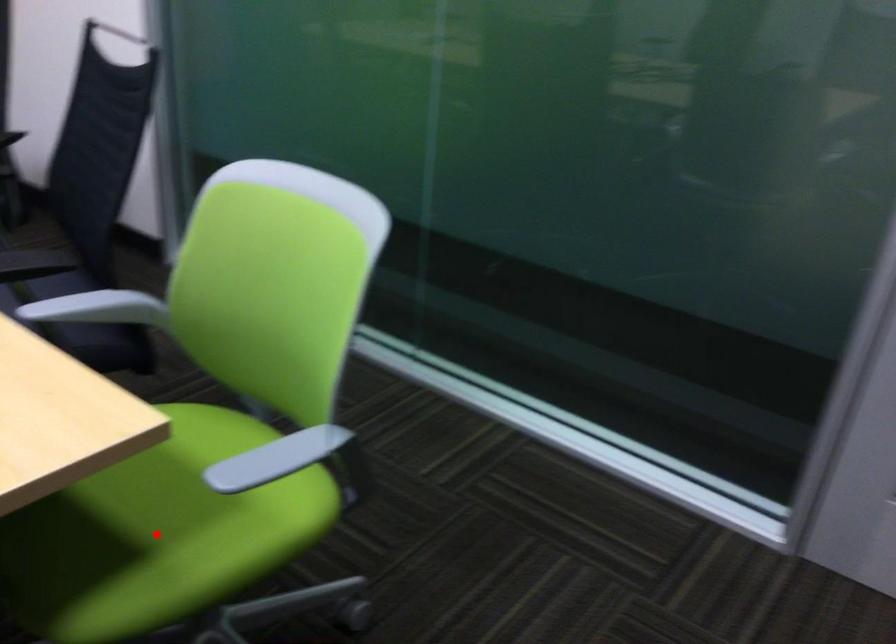
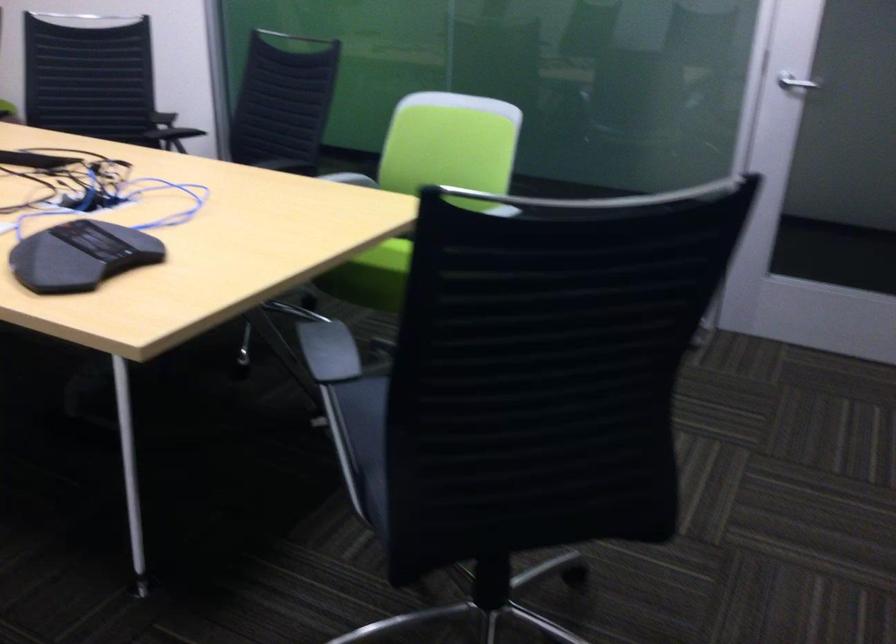
Question: I am providing you with two images of the same scene from different viewpoints. A red point is marked on the first image. Can you still see the location of the red point in image 2?

Choices:
 (A) Yes
 (B) No

Answer: (B)